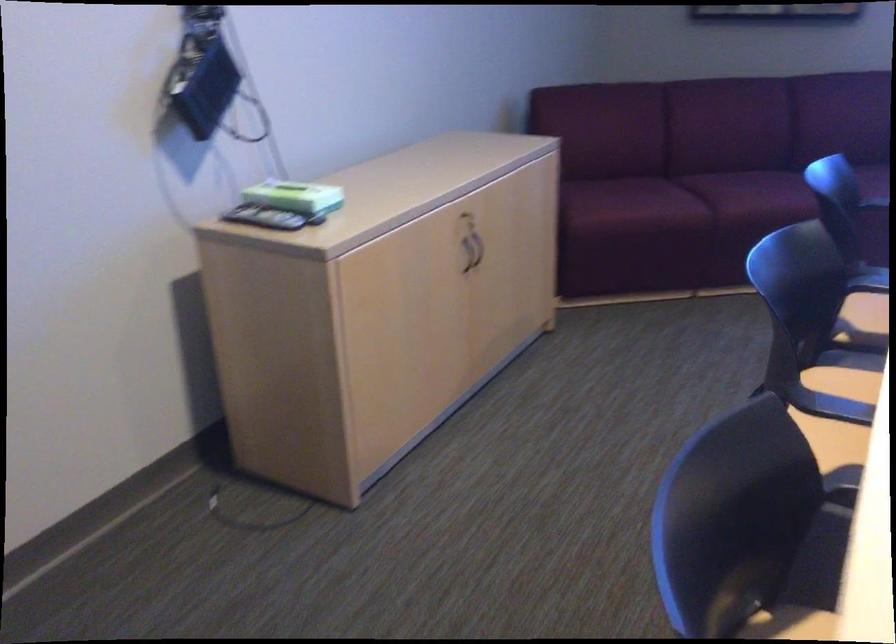
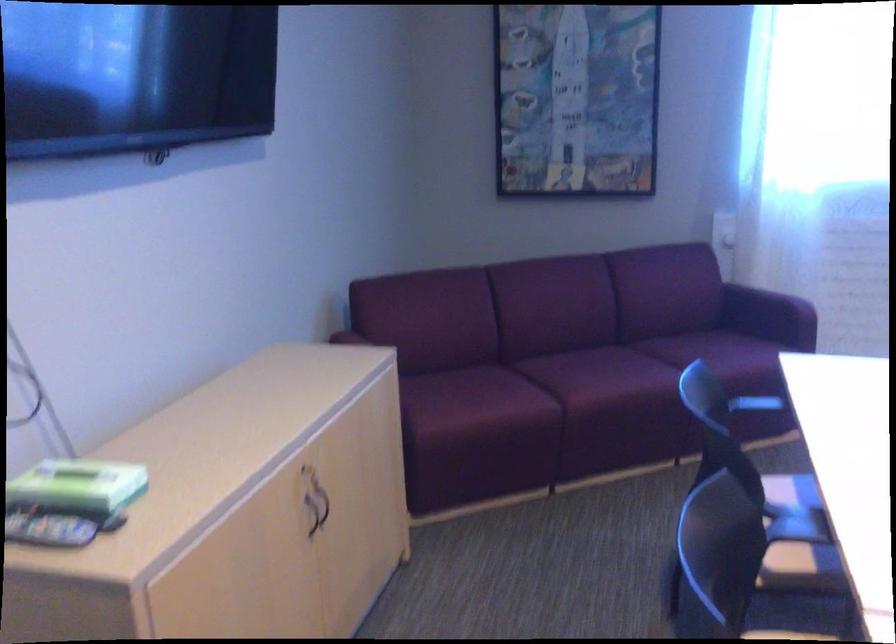
Question: How did the camera likely rotate?

Choices:
 (A) Left
 (B) Right
 (C) Up
 (D) Down

Answer: (B)